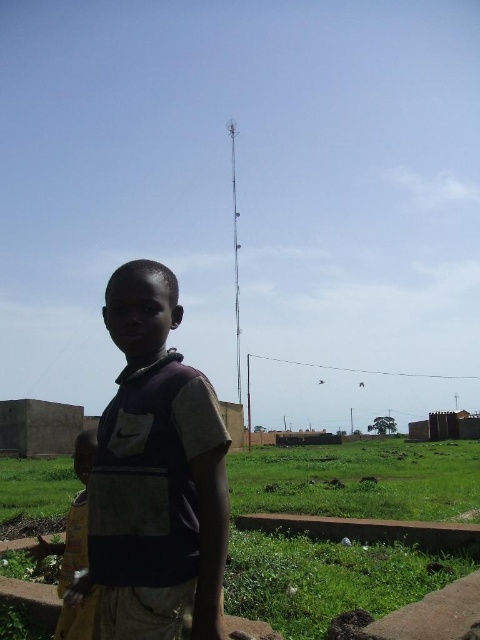
Question: Does dark purple shirt at center have a greater width compared to yellow fabric at lower left?

Choices:
 (A) no
 (B) yes

Answer: (A)

Question: Does dark purple shirt at center have a smaller size compared to yellow fabric at lower left?

Choices:
 (A) no
 (B) yes

Answer: (B)

Question: Which point appears closest to the camera in this image?

Choices:
 (A) (115, 339)
 (B) (64, 628)

Answer: (B)

Question: Is dark purple shirt at center behind yellow fabric at lower left?

Choices:
 (A) no
 (B) yes

Answer: (A)

Question: Among these objects, which one is nearest to the camera?

Choices:
 (A) yellow fabric at lower left
 (B) dark purple shirt at center

Answer: (B)